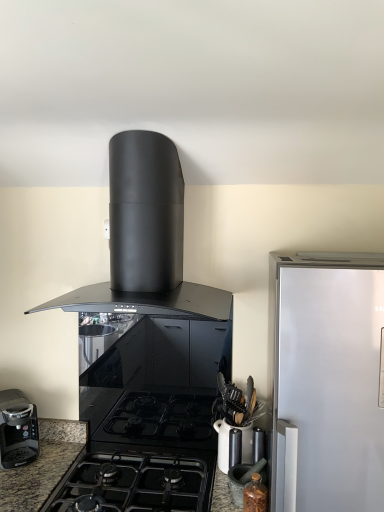
Question: From the image's perspective, is matte black mortar and pestle at lower right, placed as the 2th kitchen appliance when sorted from right to left, located beneath black matte/glossy gas stove at center?

Choices:
 (A) no
 (B) yes

Answer: (A)

Question: Considering the relative sizes of matte black mortar and pestle at lower right, placed as the 3th kitchen appliance when sorted from left to right, and black matte/glossy gas stove at center in the image provided, is matte black mortar and pestle at lower right, placed as the 3th kitchen appliance when sorted from left to right, wider than black matte/glossy gas stove at center?

Choices:
 (A) yes
 (B) no

Answer: (B)

Question: Is matte black mortar and pestle at lower right, placed as the 3th kitchen appliance when sorted from left to right, bigger than black matte/glossy gas stove at center?

Choices:
 (A) yes
 (B) no

Answer: (B)

Question: Is matte black mortar and pestle at lower right, placed as the 2th kitchen appliance when sorted from right to left, facing away from black matte/glossy gas stove at center?

Choices:
 (A) yes
 (B) no

Answer: (B)

Question: Can you confirm if matte black mortar and pestle at lower right, the third kitchen appliance when ordered from top to bottom, is smaller than black matte/glossy gas stove at center?

Choices:
 (A) yes
 (B) no

Answer: (A)

Question: From the image's perspective, is matte black mortar and pestle at lower right, placed as the 3th kitchen appliance when sorted from left to right, over black matte/glossy gas stove at center?

Choices:
 (A) no
 (B) yes

Answer: (B)

Question: Can you confirm if translucent glass jar at lower right is thinner than black matte range hood at upper center, placed as the 4th kitchen appliance when sorted from bottom to top?

Choices:
 (A) yes
 (B) no

Answer: (A)

Question: Could you tell me if translucent glass jar at lower right is turned towards black matte range hood at upper center, which ranks as the 3th kitchen appliance in right-to-left order?

Choices:
 (A) no
 (B) yes

Answer: (A)

Question: Are translucent glass jar at lower right and black matte range hood at upper center, the first kitchen appliance from the top, making contact?

Choices:
 (A) yes
 (B) no

Answer: (B)

Question: Is translucent glass jar at lower right closer to camera compared to black matte range hood at upper center, placed as the 4th kitchen appliance when sorted from bottom to top?

Choices:
 (A) yes
 (B) no

Answer: (B)

Question: Does translucent glass jar at lower right have a larger size compared to black matte range hood at upper center, the first kitchen appliance from the top?

Choices:
 (A) no
 (B) yes

Answer: (A)

Question: From the image's perspective, is translucent glass jar at lower right beneath black matte range hood at upper center, arranged as the second kitchen appliance when viewed from the left?

Choices:
 (A) yes
 (B) no

Answer: (A)

Question: Does matte black mortar and pestle at lower right, placed as the 2th kitchen appliance when sorted from right to left, have a larger size compared to black matte range hood at upper center, which ranks as the 3th kitchen appliance in right-to-left order?

Choices:
 (A) no
 (B) yes

Answer: (A)